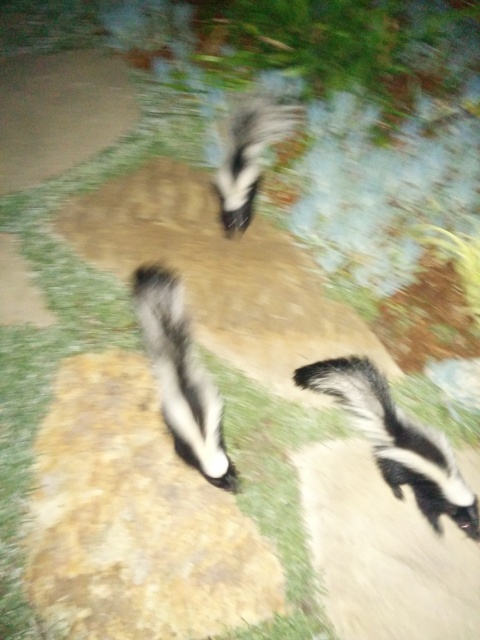
Based on the photo, you are a wildlife photographer trying to capture both skunks in a single shot. Given that your camera frame can only accommodate objects up to the width of the wider skunk, will you be able to fit both black and white fur skunk at center and black and white fur skunk at upper center into the frame?

The black and white fur skunk at upper center is wider than the black and white fur skunk at center. Since your camera frame can only accommodate up to the width of the wider skunk, you can fit both into the frame as the wider skunk is within the frame limit.

You are a wildlife photographer trying to capture a photo of the black and white fur skunk at lower right. Your camera has a focus point at coordinate 0.689, 0.827. Will this focus point help you capture the skunk clearly?

Yes, because the black and white fur skunk at lower right is exactly at position (396, 440), so the focus point will align perfectly with the skunk.

You are a photographer trying to capture both skunks in a single shot. Since the black and white fur skunk at lower right is below the black and white fur skunk at center, where should you position your camera to ensure both are in frame?

To capture both skunks in a single shot, position your camera so it can see both the black and white fur skunk at lower right and the black and white fur skunk at center. Since the skunk at lower right is below the one at center, aim the camera to include the lower right area where the skunk is positioned and the central area where the other skunk is located, ensuring the frame encompasses both positions.